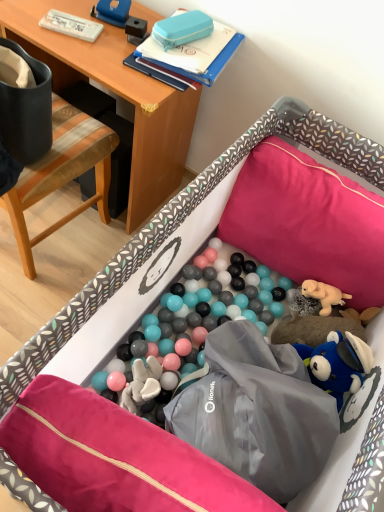
Question: Visually, is wooden desk at upper left positioned to the left or to the right of pink fabric pillow at upper right, the 1th pillow when ordered from top to bottom?

Choices:
 (A) right
 (B) left

Answer: (B)

Question: Looking at the image, does wooden desk at upper left seem bigger or smaller compared to pink fabric pillow at upper right, which ranks as the first pillow in back-to-front order?

Choices:
 (A) small
 (B) big

Answer: (B)

Question: Estimate the real-world distances between objects in this image. Which object is closer to the pink fabric pillow at upper right, the 2th pillow positioned from the front?

Choices:
 (A) wooden desk at upper left
 (B) pink fabric pillow at center, which appears as the 2th pillow when viewed from the back
 (C) woodenchair at left
 (D) blue hard plastic case at upper center

Answer: (A)

Question: Which is farther from the pink fabric pillow at center, which ranks as the 1th pillow in front-to-back order?

Choices:
 (A) blue hard plastic case at upper center
 (B) wooden desk at upper left
 (C) pink fabric pillow at upper right, the 1th pillow positioned from the right
 (D) woodenchair at left

Answer: (A)